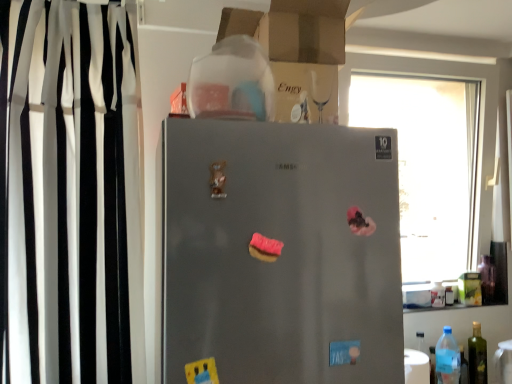
Question: Do you think pink glossy donut at center is within transparent glass window at upper right, or outside of it?

Choices:
 (A) outside
 (B) inside

Answer: (A)

Question: Visually, is pink glossy donut at center positioned to the left or to the right of transparent glass window at upper right?

Choices:
 (A) right
 (B) left

Answer: (B)

Question: Which object is positioned farthest from the green glass bottle at lower right, the 3th bottle from the left?

Choices:
 (A) satin silver fridge at center
 (B) cardboard box at upper center
 (C) pink glossy donut at center
 (D) black/white striped curtain at left
 (E) transparent plastic bottle at right, which is counted as the 1th bottle, starting from the back

Answer: (D)

Question: Which is nearer to the cardboard box at upper center?

Choices:
 (A) pink glossy donut at center
 (B) black/white striped curtain at left
 (C) blue translucent bottle at lower right, the 3th bottle from the back
 (D) transparent plastic bottle at right, which is counted as the 1th bottle, starting from the back
 (E) satin silver fridge at center

Answer: (E)